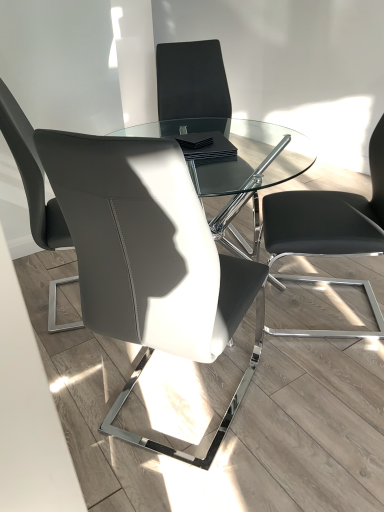
Question: Considering the relative sizes of matte black chair at center, which is the 3th chair from right to left, and matte gray leather chair at left, the 1th chair in the left-to-right sequence, in the image provided, is matte black chair at center, which is the 3th chair from right to left, wider than matte gray leather chair at left, the 1th chair in the left-to-right sequence,?

Choices:
 (A) no
 (B) yes

Answer: (B)

Question: Does matte black chair at center, which is the 3th chair from right to left, turn towards matte gray leather chair at left, the 1th chair in the left-to-right sequence?

Choices:
 (A) yes
 (B) no

Answer: (B)

Question: Is matte black chair at center, which is the 3th chair from right to left, located outside matte gray leather chair at left, the 1th chair in the left-to-right sequence?

Choices:
 (A) yes
 (B) no

Answer: (A)

Question: From the image's perspective, does matte black chair at center, which is the 3th chair from right to left, appear lower than matte gray leather chair at left, placed as the 4th chair when sorted from right to left?

Choices:
 (A) yes
 (B) no

Answer: (A)

Question: Can you confirm if matte black chair at center, acting as the 2th chair starting from the left, is taller than matte gray leather chair at left, the 1th chair in the left-to-right sequence?

Choices:
 (A) yes
 (B) no

Answer: (A)

Question: Is matte black chair at center, which is the 3th chair from right to left, spatially inside matte black chair at center, which is the 2th chair from right to left, or outside of it?

Choices:
 (A) inside
 (B) outside

Answer: (B)

Question: From the image's perspective, is matte black chair at center, which is the 3th chair from right to left, above or below matte black chair at center, which is the 2th chair from right to left?

Choices:
 (A) below
 (B) above

Answer: (A)

Question: Is matte black chair at center, acting as the 2th chair starting from the left, bigger or smaller than matte black chair at center, which is the 2th chair from right to left?

Choices:
 (A) small
 (B) big

Answer: (A)

Question: From a real-world perspective, is matte black chair at center, which is the 3th chair from right to left, positioned above or below matte black chair at center, acting as the 3th chair starting from the left?

Choices:
 (A) below
 (B) above

Answer: (B)

Question: Choose the correct answer: Is matte black chair at center, acting as the 3th chair starting from the left, inside black leather chair at right, the 1th chair positioned from the right, or outside it?

Choices:
 (A) outside
 (B) inside

Answer: (A)

Question: In terms of width, does matte black chair at center, which is the 2th chair from right to left, look wider or thinner when compared to black leather chair at right, arranged as the fourth chair when viewed from the left?

Choices:
 (A) wide
 (B) thin

Answer: (B)

Question: Relative to black leather chair at right, the 1th chair positioned from the right, is matte black chair at center, acting as the 3th chair starting from the left, in front or behind?

Choices:
 (A) front
 (B) behind

Answer: (B)

Question: Would you say matte black chair at center, which is the 2th chair from right to left, is to the left or to the right of black leather chair at right, the 1th chair positioned from the right, in the picture?

Choices:
 (A) left
 (B) right

Answer: (A)

Question: Does point (x=46, y=244) appear closer or farther from the camera than point (x=213, y=90)?

Choices:
 (A) closer
 (B) farther

Answer: (A)

Question: Is matte gray leather chair at left, the 1th chair in the left-to-right sequence, spatially inside matte black chair at center, acting as the 3th chair starting from the left, or outside of it?

Choices:
 (A) outside
 (B) inside

Answer: (A)